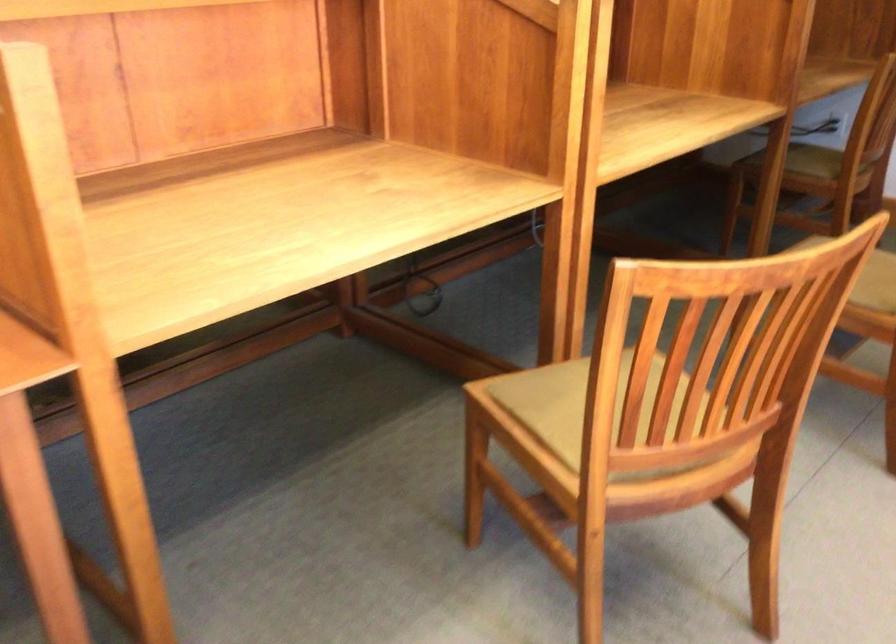
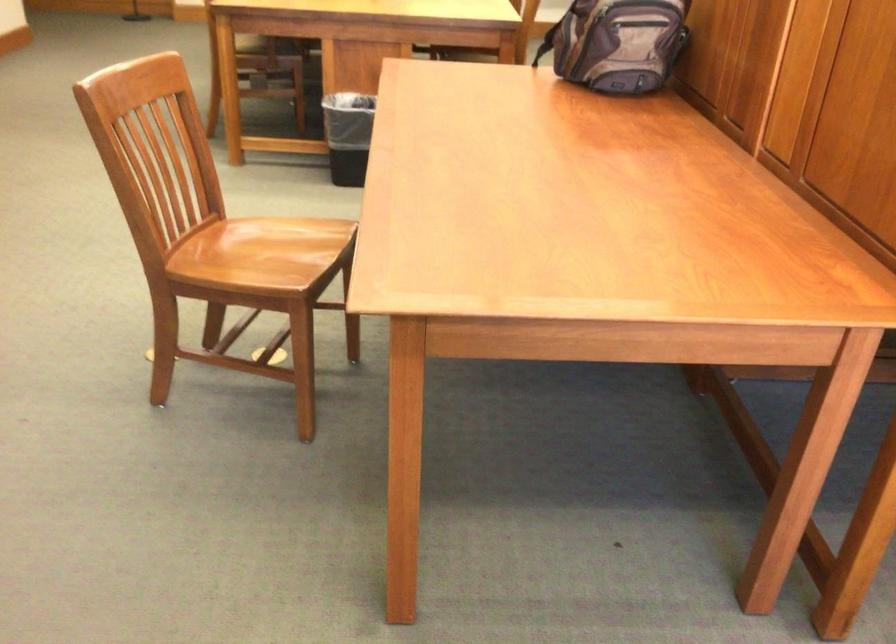
Question: The camera is either moving clockwise (left) or counter-clockwise (right) around the object. The first image is from the beginning of the video and the second image is from the end. Is the camera moving left or right when shooting the video?

Choices:
 (A) Left
 (B) Right

Answer: (B)